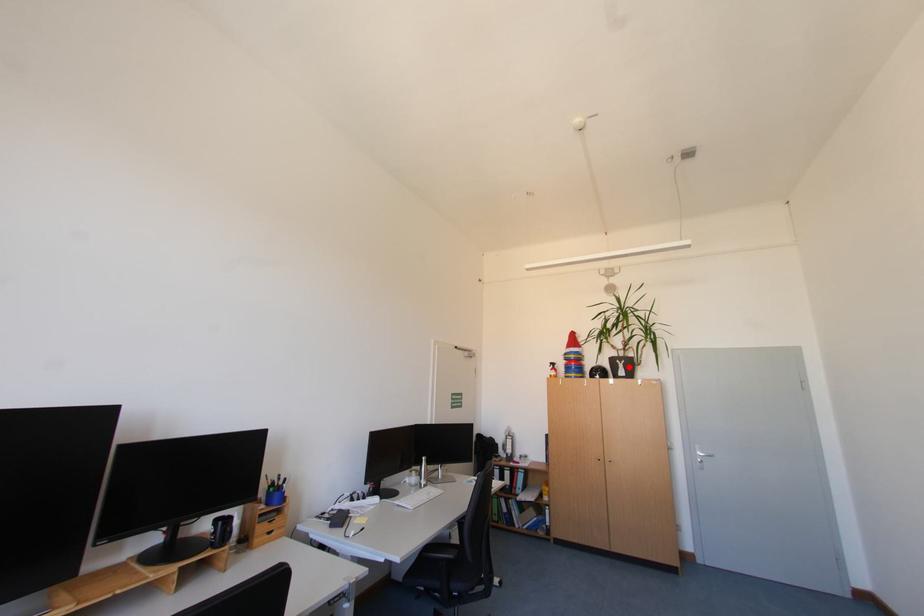
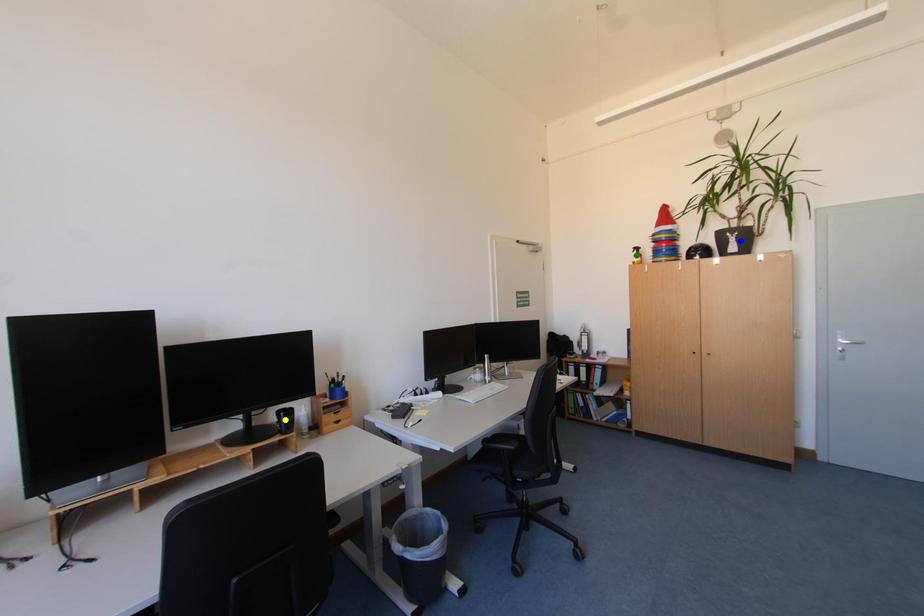
Question: I am providing you with two images of the same scene from different viewpoints. A red point is marked on the first image. You are given multiple points on the second image. Which point in image 2 is actually the same real-world point as the red point in image 1?

Choices:
 (A) yellow point
 (B) blue point
 (C) green point

Answer: (B)